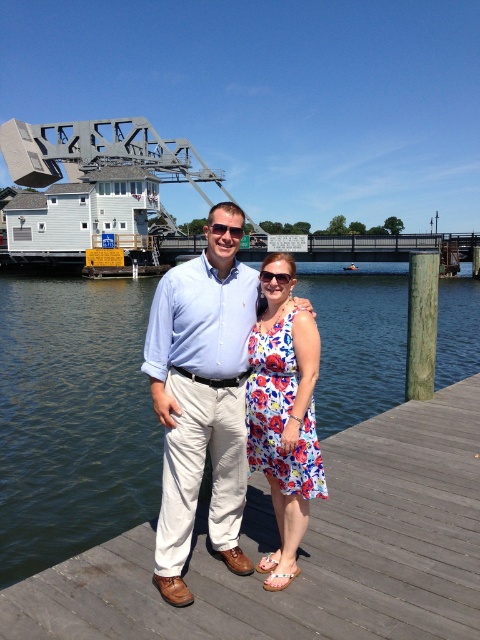
Question: Which object is positioned closest to the wooden dock at center?

Choices:
 (A) blue water at center
 (B) shiny plastic sunglasses at center

Answer: (A)

Question: Does blue water at center appear over light blue cotton shirt at center?

Choices:
 (A) no
 (B) yes

Answer: (B)

Question: Which of these objects is positioned farthest from the clear plastic sunglasses at center?

Choices:
 (A) floral fabric dress at center
 (B) wooden dock at center

Answer: (B)

Question: Does light blue cotton shirt at center have a greater width compared to shiny plastic sunglasses at center?

Choices:
 (A) no
 (B) yes

Answer: (A)

Question: Which point is closer to the camera taking this photo?

Choices:
 (A) (276, 436)
 (B) (44, 566)

Answer: (A)

Question: Can you confirm if shiny plastic sunglasses at center is positioned below clear plastic sunglasses at center?

Choices:
 (A) yes
 (B) no

Answer: (B)